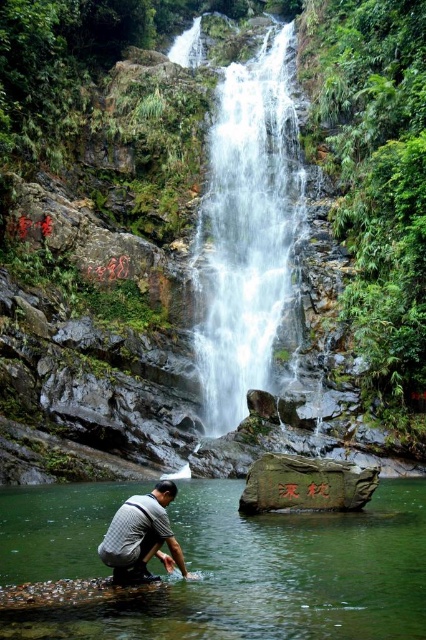
Question: Is clear water at lower center positioned behind gray fabric shirt at lower center?

Choices:
 (A) no
 (B) yes

Answer: (A)

Question: Estimate the real-world distances between objects in this image. Which object is farther from the gray fabric shirt at lower center?

Choices:
 (A) clear water at lower center
 (B) clear water at center

Answer: (B)

Question: Can you confirm if clear water at center is wider than gray fabric shirt at lower center?

Choices:
 (A) no
 (B) yes

Answer: (B)

Question: Estimate the real-world distances between objects in this image. Which object is farther from the clear water at lower center?

Choices:
 (A) clear water at center
 (B) gray fabric shirt at lower center

Answer: (A)

Question: Which of the following is the closest to the observer?

Choices:
 (A) gray fabric shirt at lower center
 (B) clear water at lower center
 (C) clear water at center

Answer: (B)

Question: Observing the image, what is the correct spatial positioning of clear water at center in reference to gray fabric shirt at lower center?

Choices:
 (A) above
 (B) below

Answer: (A)